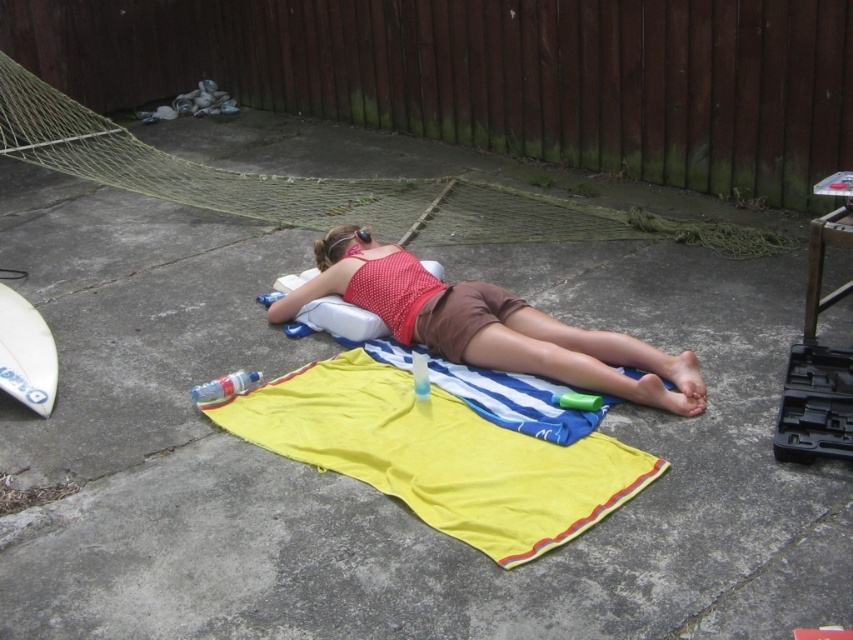
Question: Can you confirm if matte red tank top at center is positioned to the right of white matte surfboard at lower left?

Choices:
 (A) yes
 (B) no

Answer: (A)

Question: Which object is farther from the camera taking this photo?

Choices:
 (A) yellow fabric towel at center
 (B) white matte surfboard at lower left
 (C) matte red tank top at center

Answer: (B)

Question: Among these objects, which one is farthest from the camera?

Choices:
 (A) white matte surfboard at lower left
 (B) yellow fabric towel at center
 (C) matte red tank top at center

Answer: (A)

Question: Which point is farther to the camera?

Choices:
 (A) yellow fabric towel at center
 (B) white matte surfboard at lower left
 (C) matte red tank top at center

Answer: (B)

Question: Does matte red tank top at center have a larger size compared to white matte surfboard at lower left?

Choices:
 (A) yes
 (B) no

Answer: (A)

Question: Observing the image, what is the correct spatial positioning of yellow fabric towel at center in reference to matte red tank top at center?

Choices:
 (A) right
 (B) left

Answer: (B)